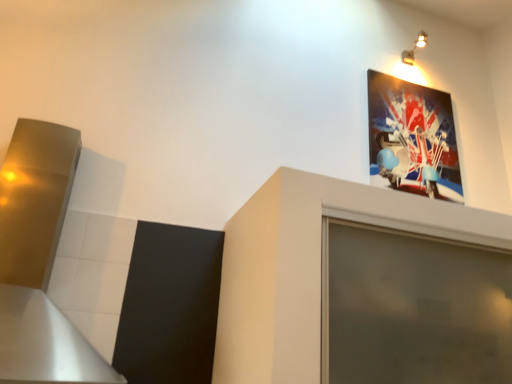
Question: Does metallic spotlights at upper right have a smaller size compared to brushed metal exhaust hood at left?

Choices:
 (A) no
 (B) yes

Answer: (B)

Question: Are metallic spotlights at upper right and brushed metal exhaust hood at left far apart?

Choices:
 (A) no
 (B) yes

Answer: (B)

Question: Does metallic spotlights at upper right have a lesser width compared to brushed metal exhaust hood at left?

Choices:
 (A) no
 (B) yes

Answer: (B)

Question: Is metallic spotlights at upper right aimed at brushed metal exhaust hood at left?

Choices:
 (A) yes
 (B) no

Answer: (B)

Question: From the image's perspective, is metallic spotlights at upper right under brushed metal exhaust hood at left?

Choices:
 (A) no
 (B) yes

Answer: (A)

Question: Would you say metallic spotlights at upper right is to the left or to the right of brushed metal exhaust hood at left in the picture?

Choices:
 (A) left
 (B) right

Answer: (B)

Question: From the image's perspective, relative to brushed metal exhaust hood at left, is metallic spotlights at upper right above or below?

Choices:
 (A) below
 (B) above

Answer: (B)

Question: Which is correct: metallic spotlights at upper right is inside brushed metal exhaust hood at left, or outside of it?

Choices:
 (A) outside
 (B) inside

Answer: (A)

Question: Relative to brushed metal exhaust hood at left, is metallic spotlights at upper right in front or behind?

Choices:
 (A) front
 (B) behind

Answer: (B)

Question: Visually, is matte plastic picture frame at upper right positioned to the left or to the right of brushed metal exhaust hood at left?

Choices:
 (A) right
 (B) left

Answer: (A)

Question: Does point (368, 97) appear closer or farther from the camera than point (68, 130)?

Choices:
 (A) closer
 (B) farther

Answer: (B)

Question: Choose the correct answer: Is matte plastic picture frame at upper right inside brushed metal exhaust hood at left or outside it?

Choices:
 (A) inside
 (B) outside

Answer: (B)

Question: From a real-world perspective, relative to brushed metal exhaust hood at left, is matte plastic picture frame at upper right vertically above or below?

Choices:
 (A) above
 (B) below

Answer: (A)

Question: Is point (30, 137) positioned closer to the camera than point (412, 64)?

Choices:
 (A) farther
 (B) closer

Answer: (B)

Question: Visually, is brushed metal exhaust hood at left positioned to the left or to the right of metallic spotlights at upper right?

Choices:
 (A) left
 (B) right

Answer: (A)